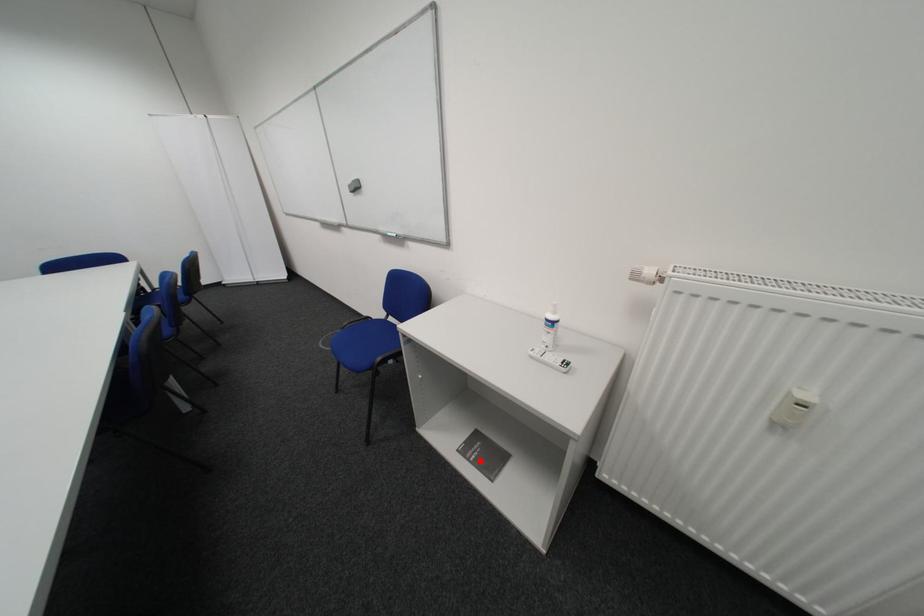
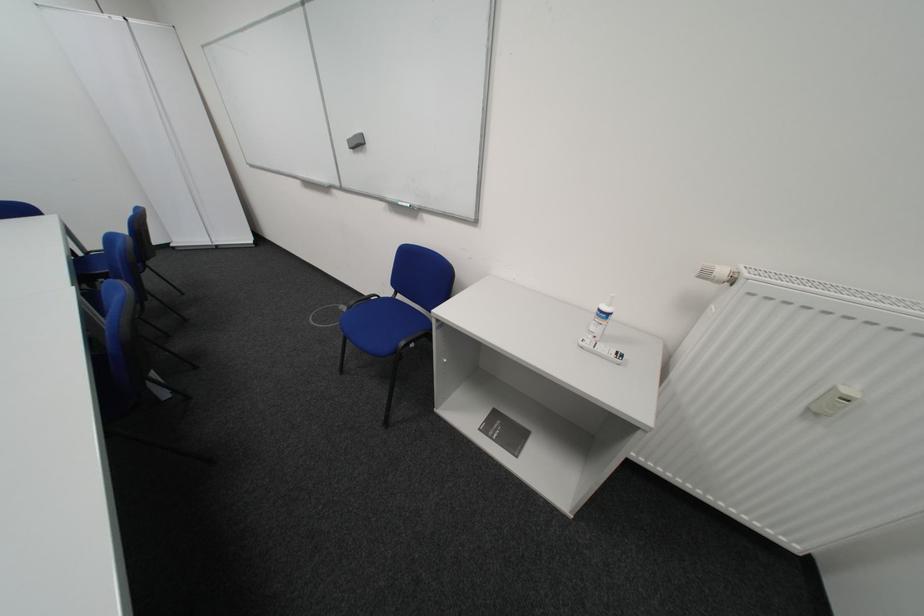
Find the pixel in the second image that matches the highlighted location in the first image.

(504, 439)